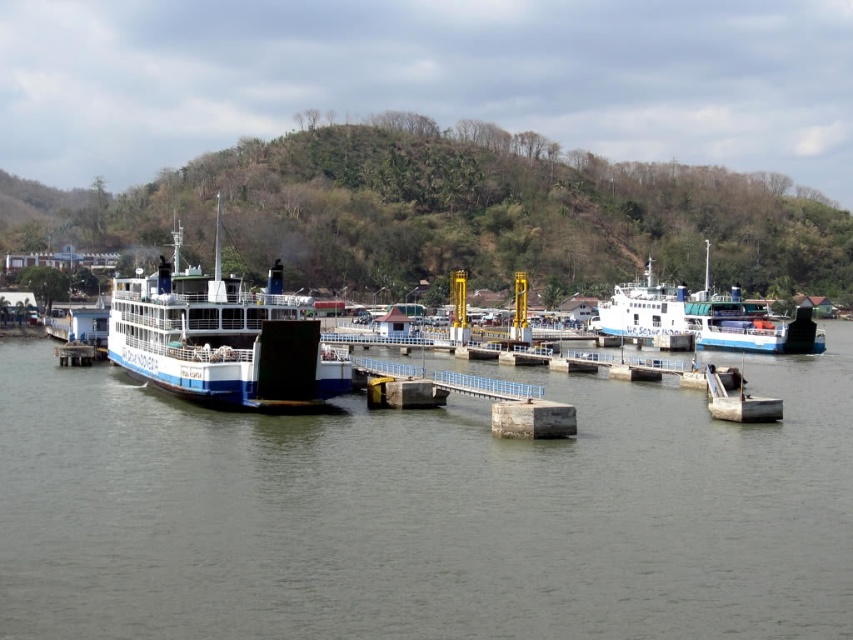
You are a passenger standing on the terminal and want to board the ferry that is farther away. Which ferry should you walk towards, the blue matte ferry at center or the white glossy ferry at center?

The blue matte ferry at center is closer to the viewer than the white glossy ferry at center, so to board the ferry that is farther away, you should walk towards the white glossy ferry at center.

You are standing at the ferry terminal and want to reach the blue hull ferry on the left. The terminal has ramps with blue rails leading to the ferries. If the point (436, 442) represents the distance from you to the ferry, can you walk directly to it without needing to go around any obstacles?

The point at coordinates (436, 442) is 159.70 feet away from you. Since there are ramps with blue rails leading directly to the ferry, you can walk straight to the blue hull ferry on the left without needing to go around obstacles.

You are standing at the ferry terminal and see the point marked at coordinates (221, 337). Which ferry is this point located on?

The point marked at coordinates (221, 337) is located on the blue matte ferry at center.